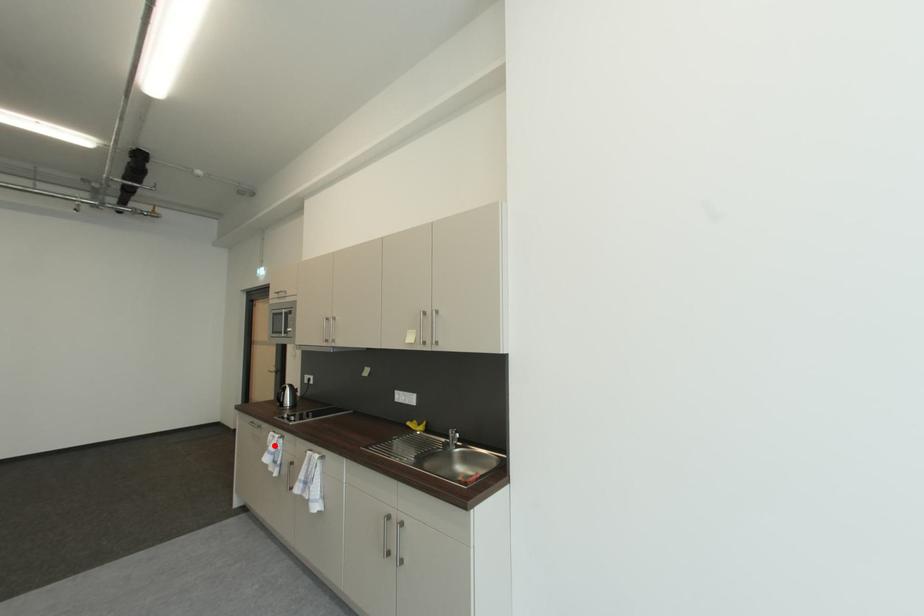
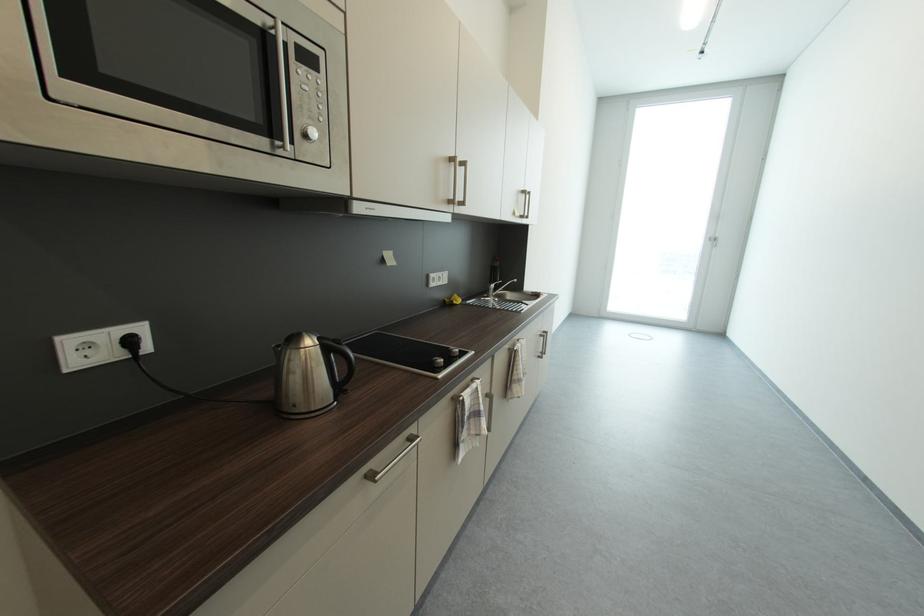
Find the pixel in the second image that matches the highlighted location in the first image.

(472, 419)